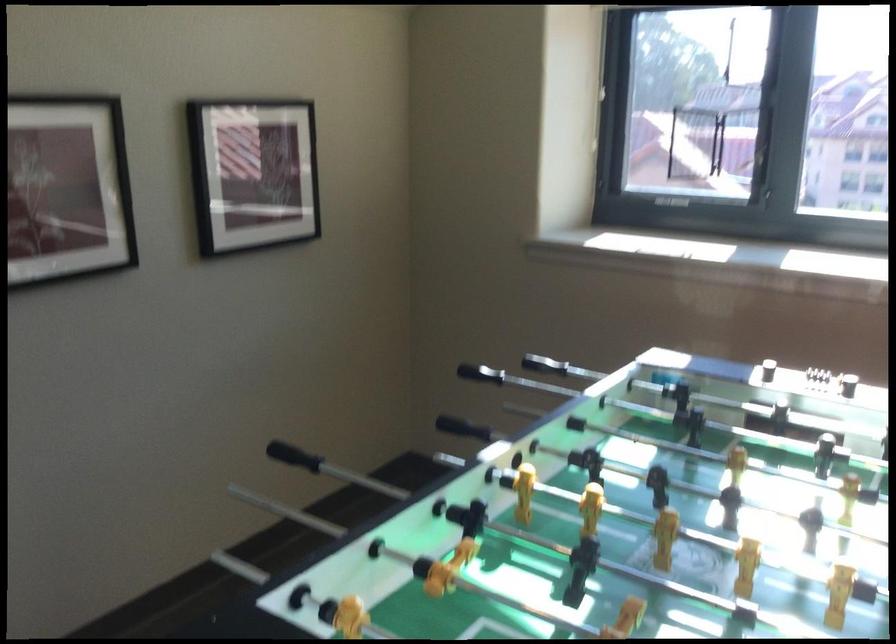
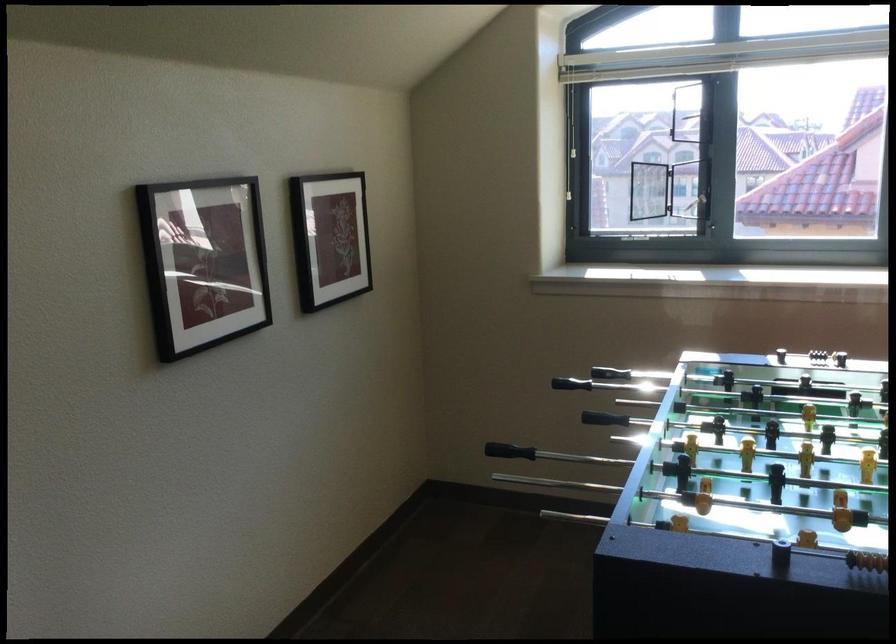
Where in the second image is the point corresponding to point 682,154 from the first image?

(648, 190)